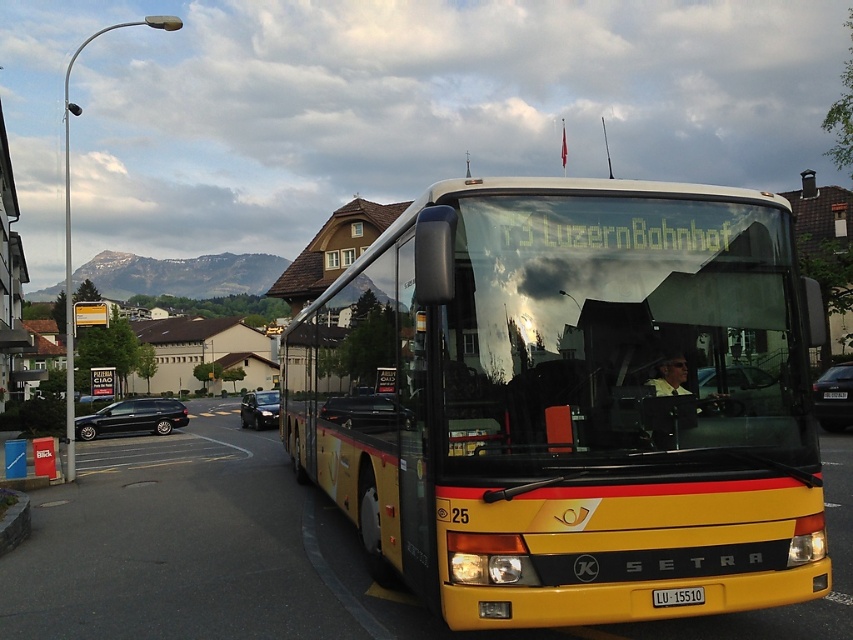
Question: In this image, where is black glossy sedan at center located relative to yellow matte license plate at center?

Choices:
 (A) above
 (B) below

Answer: (A)

Question: Estimate the real-world distances between objects in this image. Which object is farther from the black glossy sedan at center?

Choices:
 (A) shiny black sedan at center
 (B) white plastic license plate at center

Answer: (A)

Question: Is metallic silver car at center further to camera compared to shiny black sedan at left?

Choices:
 (A) yes
 (B) no

Answer: (B)

Question: Can you confirm if yellow matte bus at center is positioned below black glossy sedan at center?

Choices:
 (A) no
 (B) yes

Answer: (A)

Question: Which point is closer to the camera?

Choices:
 (A) (679, 600)
 (B) (151, 417)
 (C) (747, 385)
 (D) (838, 394)

Answer: (A)

Question: Based on their relative distances, which object is nearer to the white plastic license plate at center?

Choices:
 (A) shiny black sedan at left
 (B) metallic silver car at center

Answer: (B)